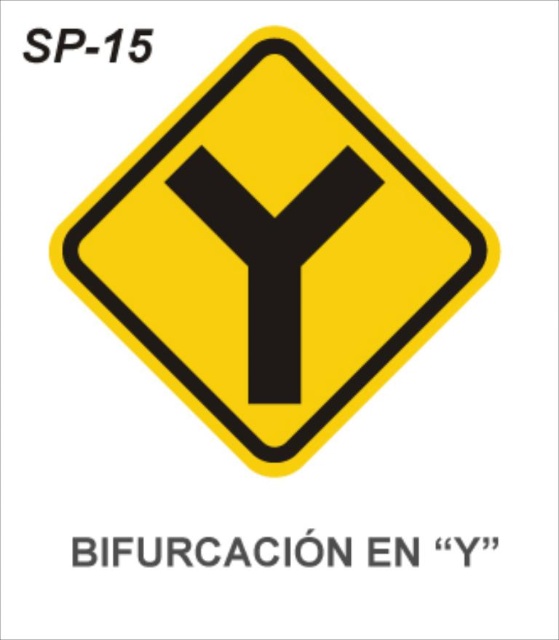
Question: Can you confirm if yellow matte diamond at center is positioned to the right of black matte arrow at center?

Choices:
 (A) yes
 (B) no

Answer: (A)

Question: Is yellow matte diamond at center above black matte arrow at center?

Choices:
 (A) yes
 (B) no

Answer: (A)

Question: Which point appears closest to the camera in this image?

Choices:
 (A) (321, 211)
 (B) (78, 216)

Answer: (B)

Question: Is yellow matte diamond at center wider than black matte arrow at center?

Choices:
 (A) no
 (B) yes

Answer: (B)